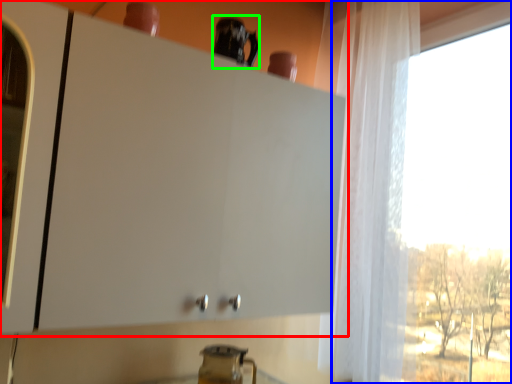
Question: Considering the real-world distances, which object is closest to cabinetry (highlighted by a red box)? window (highlighted by a blue box) or appliance (highlighted by a green box).

Choices:
 (A) window
 (B) appliance

Answer: (B)